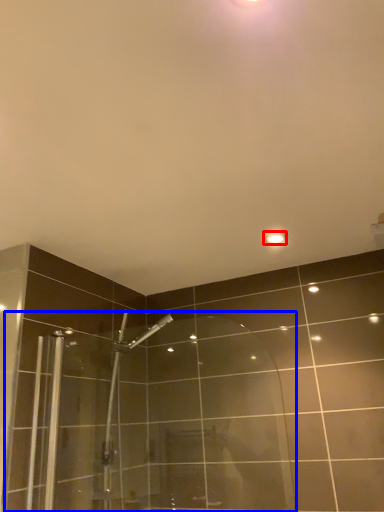
Question: Which of the following is the farthest to the observer, light fixture (highlighted by a red box) or shower door (highlighted by a blue box)?

Choices:
 (A) light fixture
 (B) shower door

Answer: (A)